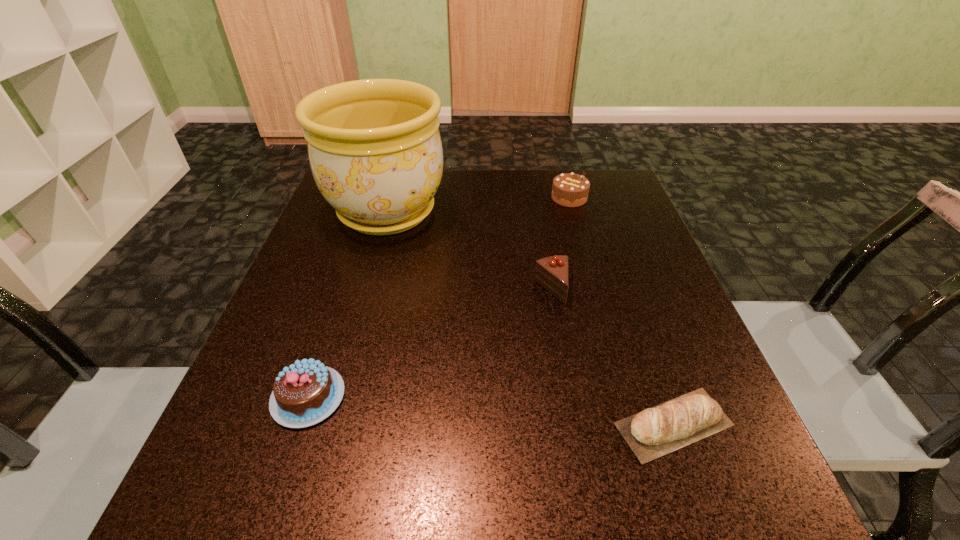
In order to click on object situated at the near right corner in this screenshot , I will do `click(696, 414)`.

The height and width of the screenshot is (540, 960). In order to click on vacant area at the far edge of the desktop in this screenshot , I will do `click(474, 211)`.

In the image, there is a desktop. Where is `vacant space at the left edge`? vacant space at the left edge is located at coordinates (356, 254).

This screenshot has height=540, width=960. In order to click on vacant space at the right edge of the desktop in this screenshot , I will do `click(614, 249)`.

Find the location of a particular element. free space at the near right corner of the desktop is located at coordinates (716, 464).

Locate an element on the screen. The height and width of the screenshot is (540, 960). vacant region between the flowerpot and the leftmost chocolate cake is located at coordinates [348, 304].

The width and height of the screenshot is (960, 540). Find the location of `vacant area that lies between the nearest chocolate cake and the third object from right to left`. vacant area that lies between the nearest chocolate cake and the third object from right to left is located at coordinates (430, 343).

Locate an element on the screen. This screenshot has height=540, width=960. free spot between the shortest object and the nearest chocolate cake is located at coordinates (491, 410).

Locate an element on the screen. This screenshot has height=540, width=960. vacant area between the nearest chocolate cake and the tallest object is located at coordinates (348, 304).

Image resolution: width=960 pixels, height=540 pixels. I want to click on vacant region between the third object from left to right and the shortest object, so click(x=612, y=357).